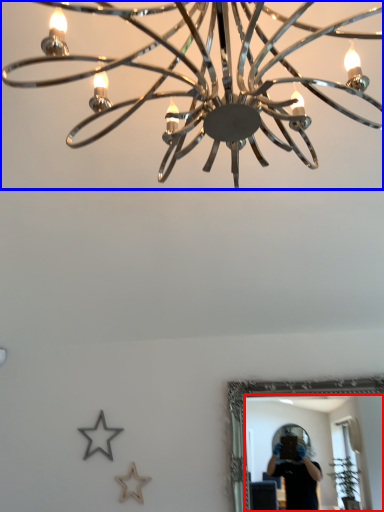
Question: Which of the following is the closest to the observer, mirror (highlighted by a red box) or lamp (highlighted by a blue box)?

Choices:
 (A) mirror
 (B) lamp

Answer: (B)